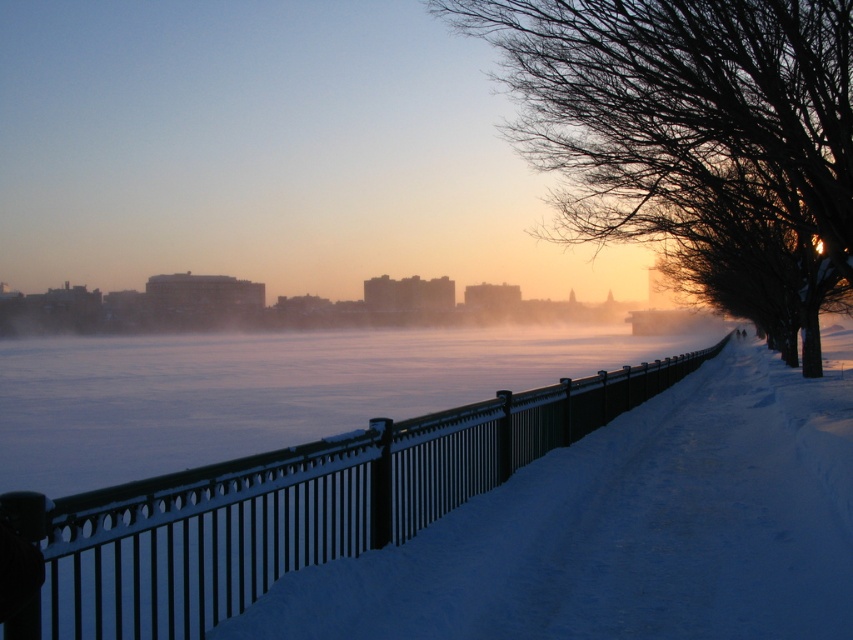
Between bare branches at upper right and black metal fence at center, which one has more height?

With more height is bare branches at upper right.

Is bare branches at upper right further to camera compared to black metal fence at center?

Yes.

Between point (834, 193) and point (9, 515), which one is positioned in front?

Point (9, 515) is in front.

The height and width of the screenshot is (640, 853). I want to click on bare branches at upper right, so 693,138.